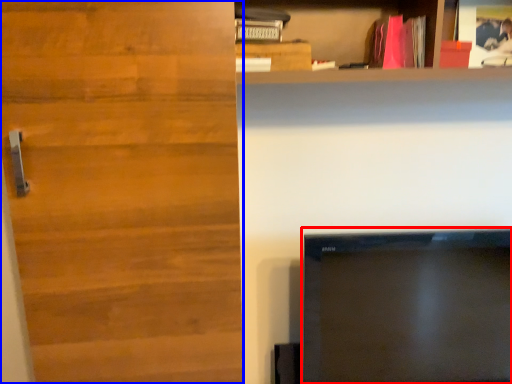
Question: Which object is closer to the camera taking this photo, television (highlighted by a red box) or door (highlighted by a blue box)?

Choices:
 (A) television
 (B) door

Answer: (B)